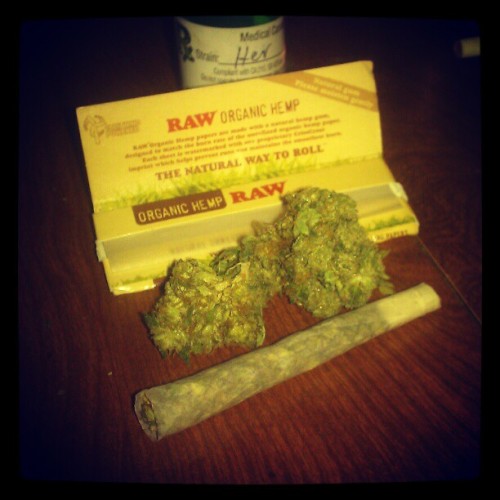
Find the location of `medication bottle`. medication bottle is located at coordinates (212, 43).